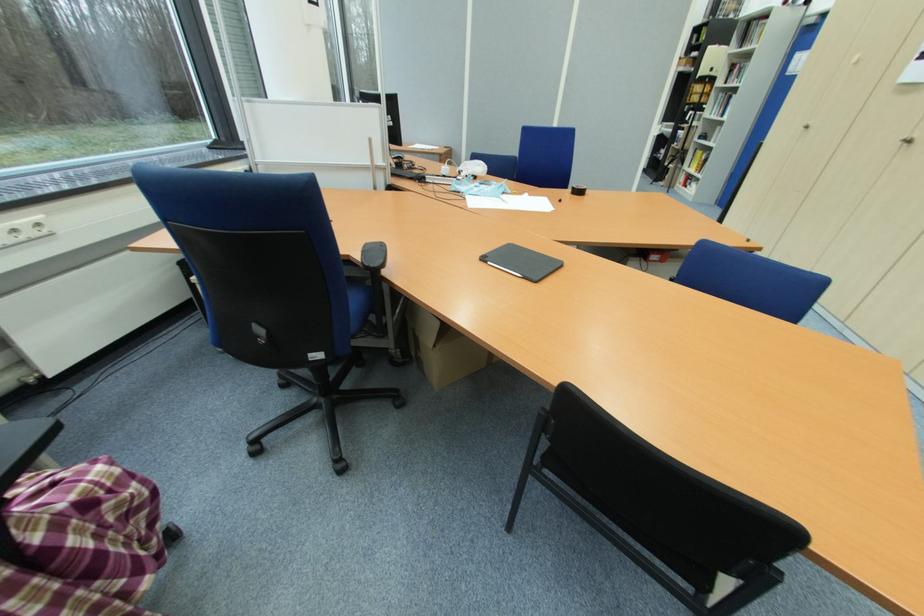
Where is `black chair armrest`? black chair armrest is located at coordinates tap(372, 256).